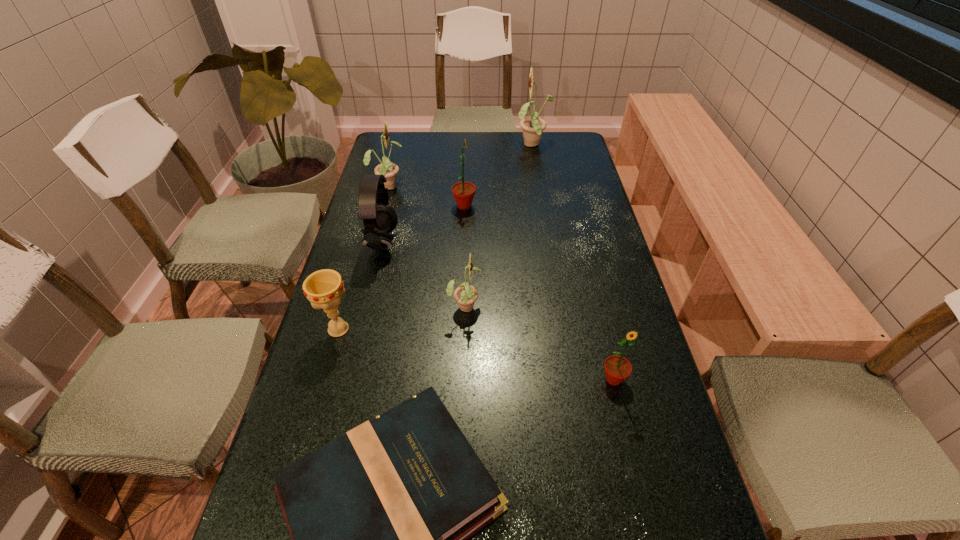
This screenshot has width=960, height=540. Identify the location of the tallest sunflower. point(533,127).

The height and width of the screenshot is (540, 960). I want to click on the rightmost yellow sunflower, so click(533, 127).

Where is `the second farthest object`? This screenshot has height=540, width=960. the second farthest object is located at coordinates click(389, 170).

You are a GUI agent. You are given a task and a screenshot of the screen. Output one action in this format:
    pyautogui.click(x=<x>, y=<y>)
    Task: Click on the second farthest yellow sunflower
    The height and width of the screenshot is (540, 960).
    Given the screenshot: What is the action you would take?
    pyautogui.click(x=389, y=170)

Where is `the farther green sunflower`? the farther green sunflower is located at coordinates (463, 192).

This screenshot has height=540, width=960. What are the coordinates of `the left green sunflower` in the screenshot? It's located at (463, 192).

Image resolution: width=960 pixels, height=540 pixels. In order to click on earphone in this screenshot , I will do `click(379, 219)`.

Locate an element on the screen. black earphone is located at coordinates (379, 219).

Find the location of a particular element. the fourth farthest sunflower is located at coordinates (465, 295).

Where is `the nearest yellow sunflower`? the nearest yellow sunflower is located at coordinates [x=465, y=295].